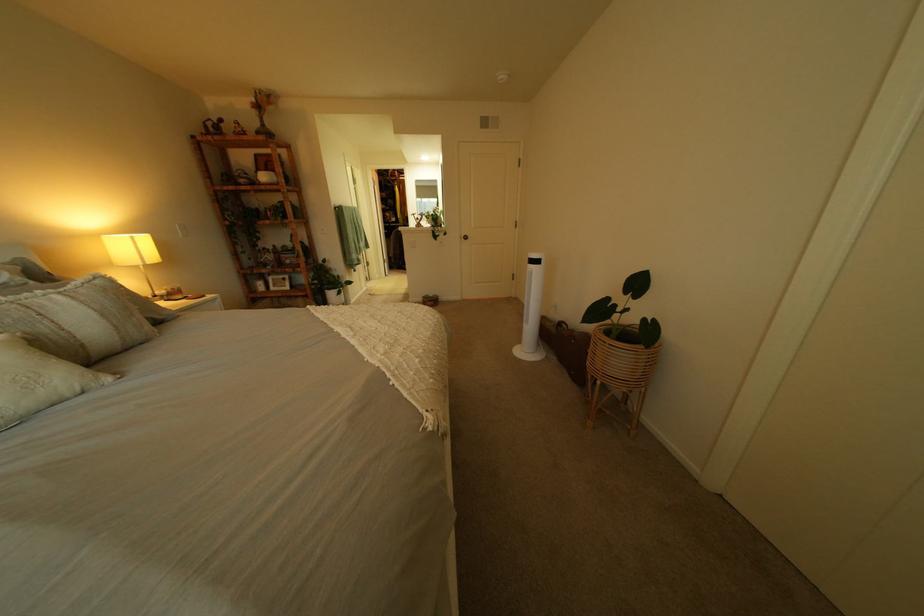
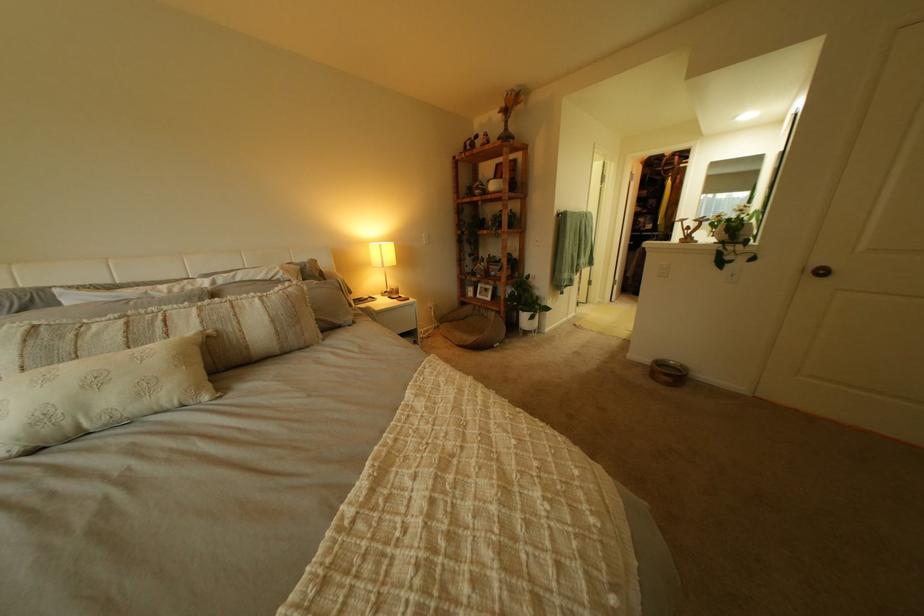
The point at (277, 294) is marked in the first image. Where is the corresponding point in the second image?

(485, 300)